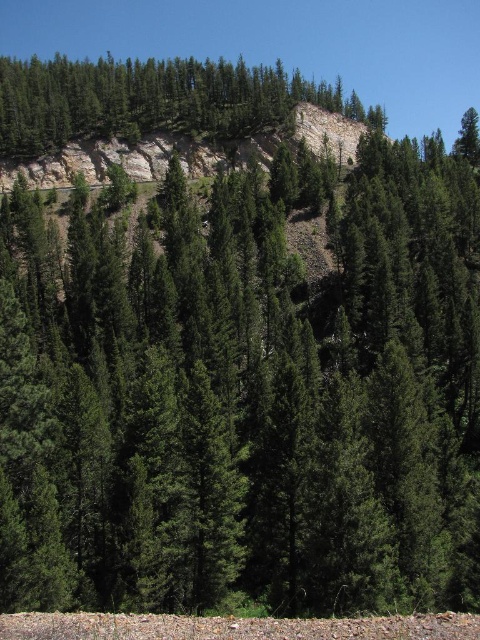
Who is positioned more to the left, green textured rock at upper center or rustic stone cliff at upper center?

From the viewer's perspective, rustic stone cliff at upper center appears more on the left side.

Measure the distance between green textured rock at upper center and rustic stone cliff at upper center.

green textured rock at upper center and rustic stone cliff at upper center are 14.15 meters apart from each other.

What do you see at coordinates (154, 100) in the screenshot? I see `green textured rock at upper center` at bounding box center [154, 100].

Identify the location of green textured rock at upper center. The width and height of the screenshot is (480, 640). (154, 100).